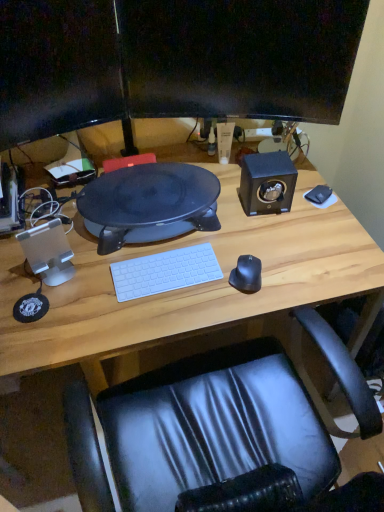
The width and height of the screenshot is (384, 512). Find the location of `empty space that is in between white matte keyboard at center and black plastic computer at center`. empty space that is in between white matte keyboard at center and black plastic computer at center is located at coordinates (156, 252).